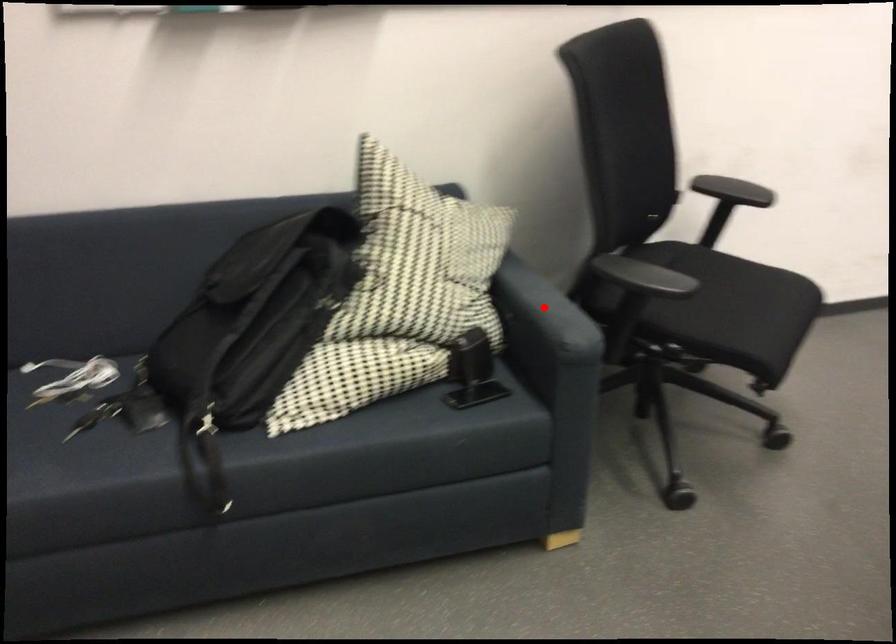
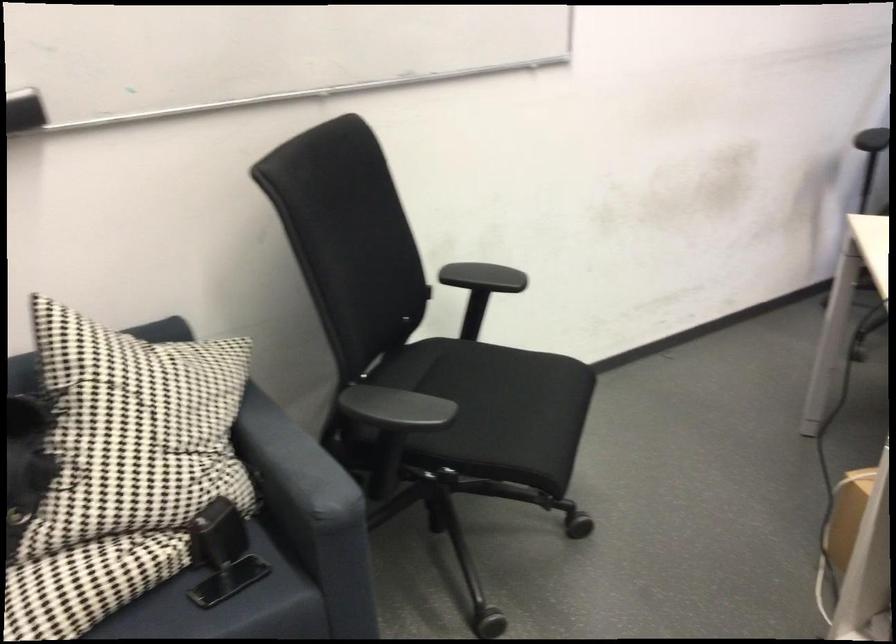
Question: I am providing you with two images of the same scene from different viewpoints. In image1, a red point is highlighted. Considering the same 3D point in image2, which of the following is correct?

Choices:
 (A) It is closer
 (B) It is farther

Answer: (A)